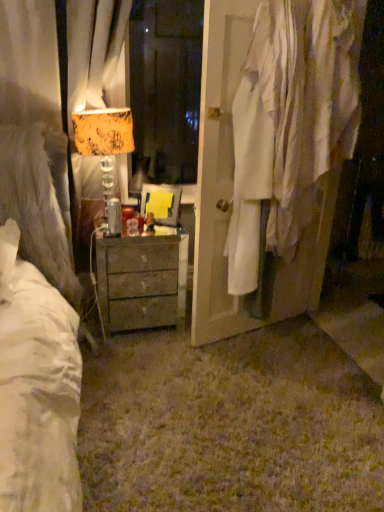
Question: From a real-world perspective, is orange-patterned fabric lampshade at left located higher than rustic wood chest of drawers at center?

Choices:
 (A) no
 (B) yes

Answer: (B)

Question: Is orange-patterned fabric lampshade at left facing towards rustic wood chest of drawers at center?

Choices:
 (A) yes
 (B) no

Answer: (B)

Question: Considering the relative sizes of orange-patterned fabric lampshade at left and rustic wood chest of drawers at center in the image provided, is orange-patterned fabric lampshade at left taller than rustic wood chest of drawers at center?

Choices:
 (A) yes
 (B) no

Answer: (A)

Question: Is the surface of orange-patterned fabric lampshade at left in direct contact with rustic wood chest of drawers at center?

Choices:
 (A) no
 (B) yes

Answer: (A)

Question: Considering the relative positions of orange-patterned fabric lampshade at left and rustic wood chest of drawers at center in the image provided, is orange-patterned fabric lampshade at left behind rustic wood chest of drawers at center?

Choices:
 (A) no
 (B) yes

Answer: (A)

Question: Is orange-patterned fabric lampshade at left bigger or smaller than white fabric at right?

Choices:
 (A) small
 (B) big

Answer: (A)

Question: Is point (97, 150) positioned closer to the camera than point (329, 112)?

Choices:
 (A) closer
 (B) farther

Answer: (B)

Question: Is orange-patterned fabric lampshade at left inside the boundaries of white fabric at right, or outside?

Choices:
 (A) inside
 (B) outside

Answer: (B)

Question: Considering the positions of orange-patterned fabric lampshade at left and white fabric at right in the image, is orange-patterned fabric lampshade at left wider or thinner than white fabric at right?

Choices:
 (A) wide
 (B) thin

Answer: (B)

Question: From a real-world perspective, is rustic wood chest of drawers at center positioned above or below orange-patterned fabric lampshade at left?

Choices:
 (A) above
 (B) below

Answer: (B)

Question: Would you say rustic wood chest of drawers at center is to the left or to the right of orange-patterned fabric lampshade at left in the picture?

Choices:
 (A) right
 (B) left

Answer: (A)

Question: Relative to orange-patterned fabric lampshade at left, is rustic wood chest of drawers at center in front or behind?

Choices:
 (A) front
 (B) behind

Answer: (B)

Question: From the image's perspective, is rustic wood chest of drawers at center above or below orange-patterned fabric lampshade at left?

Choices:
 (A) below
 (B) above

Answer: (A)

Question: Considering the positions of rustic wood chest of drawers at center and white fabric at right in the image, is rustic wood chest of drawers at center taller or shorter than white fabric at right?

Choices:
 (A) short
 (B) tall

Answer: (A)

Question: Considering the relative positions of rustic wood chest of drawers at center and white fabric at right in the image provided, is rustic wood chest of drawers at center to the left or to the right of white fabric at right?

Choices:
 (A) left
 (B) right

Answer: (A)